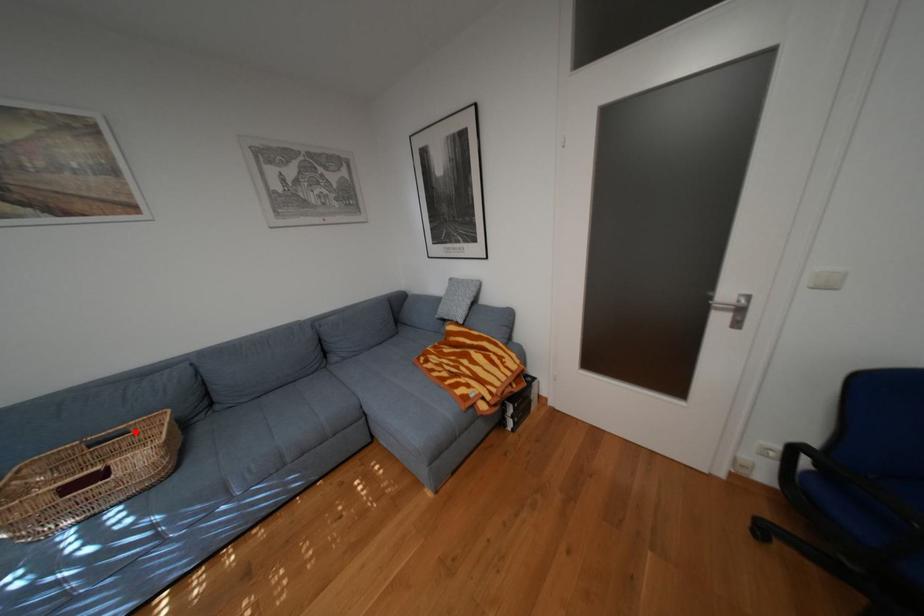
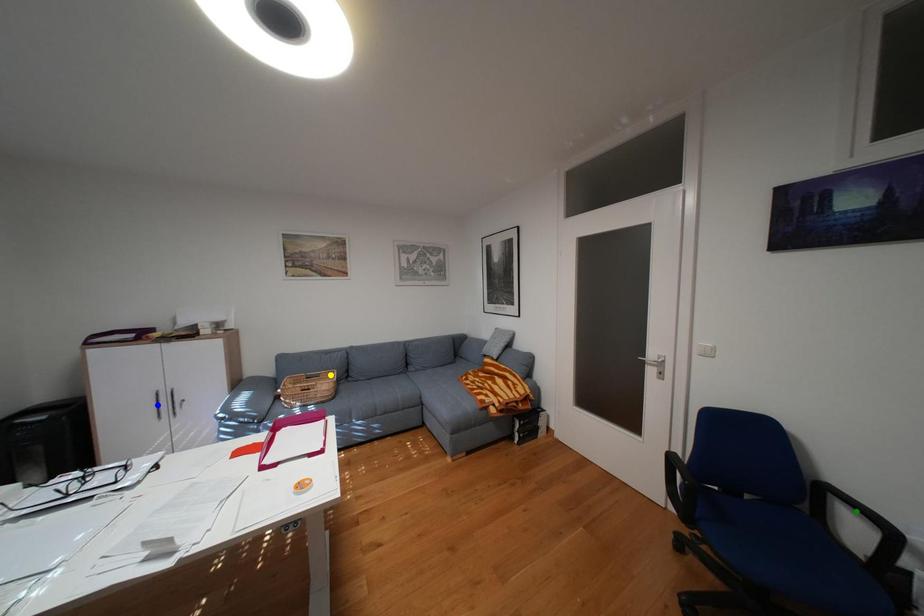
Question: I am providing you with two images of the same scene from different viewpoints. A red point is marked on the first image. You are given multiple points on the second image. In image 2, which mark is for the same physical point as the one in image 1?

Choices:
 (A) blue point
 (B) yellow point
 (C) green point

Answer: (B)